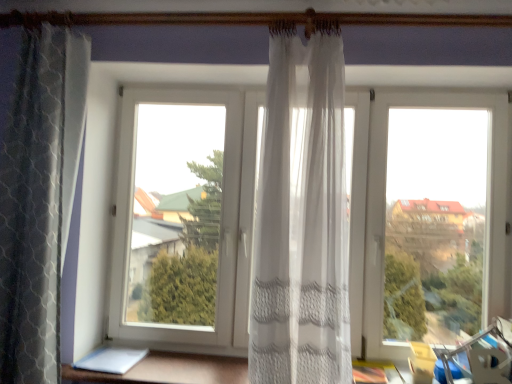
Question: From a real-world perspective, is sheer white curtain at center, marked as the first curtain in a right-to-left arrangement, physically below textured gray curtain at left, arranged as the second curtain when viewed from the right?

Choices:
 (A) no
 (B) yes

Answer: (A)

Question: Is sheer white curtain at center, marked as the first curtain in a right-to-left arrangement, wider than textured gray curtain at left, arranged as the second curtain when viewed from the right?

Choices:
 (A) yes
 (B) no

Answer: (A)

Question: From a real-world perspective, does sheer white curtain at center, which ranks as the 2th curtain in left-to-right order, stand above textured gray curtain at left, arranged as the second curtain when viewed from the right?

Choices:
 (A) no
 (B) yes

Answer: (B)

Question: From the image's perspective, is sheer white curtain at center, which ranks as the 2th curtain in left-to-right order, located above textured gray curtain at left, arranged as the 1th curtain when viewed from the left?

Choices:
 (A) no
 (B) yes

Answer: (A)

Question: Is sheer white curtain at center, which ranks as the 2th curtain in left-to-right order, at the right side of textured gray curtain at left, arranged as the 1th curtain when viewed from the left?

Choices:
 (A) no
 (B) yes

Answer: (B)

Question: Is point (507, 109) positioned closer to the camera than point (64, 54)?

Choices:
 (A) closer
 (B) farther

Answer: (B)

Question: In terms of size, does transparent plastic window at center appear bigger or smaller than textured gray curtain at left, arranged as the 1th curtain when viewed from the left?

Choices:
 (A) big
 (B) small

Answer: (A)

Question: From the image's perspective, is transparent plastic window at center located above or below textured gray curtain at left, arranged as the second curtain when viewed from the right?

Choices:
 (A) below
 (B) above

Answer: (A)

Question: Is transparent plastic window at center situated inside textured gray curtain at left, arranged as the second curtain when viewed from the right, or outside?

Choices:
 (A) inside
 (B) outside

Answer: (B)

Question: Do you think white sheer curtain at lower center is within sheer white curtain at center, marked as the first curtain in a right-to-left arrangement, or outside of it?

Choices:
 (A) outside
 (B) inside

Answer: (A)

Question: From the image's perspective, is white sheer curtain at lower center located above or below sheer white curtain at center, which ranks as the 2th curtain in left-to-right order?

Choices:
 (A) below
 (B) above

Answer: (A)

Question: From a real-world perspective, relative to sheer white curtain at center, marked as the first curtain in a right-to-left arrangement, is white sheer curtain at lower center vertically above or below?

Choices:
 (A) above
 (B) below

Answer: (B)

Question: Considering the positions of white sheer curtain at lower center and sheer white curtain at center, marked as the first curtain in a right-to-left arrangement, in the image, is white sheer curtain at lower center taller or shorter than sheer white curtain at center, marked as the first curtain in a right-to-left arrangement,?

Choices:
 (A) tall
 (B) short

Answer: (B)

Question: From the image's perspective, is white sheer curtain at lower center located above or below textured gray curtain at left, arranged as the second curtain when viewed from the right?

Choices:
 (A) below
 (B) above

Answer: (A)

Question: Considering the relative positions of white sheer curtain at lower center and textured gray curtain at left, arranged as the second curtain when viewed from the right, in the image provided, is white sheer curtain at lower center to the left or to the right of textured gray curtain at left, arranged as the second curtain when viewed from the right,?

Choices:
 (A) right
 (B) left

Answer: (A)